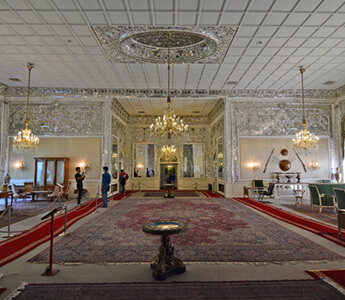
The image size is (345, 300). Identify the location of golden chandeliers. 26,138, 167,122, 303,144.